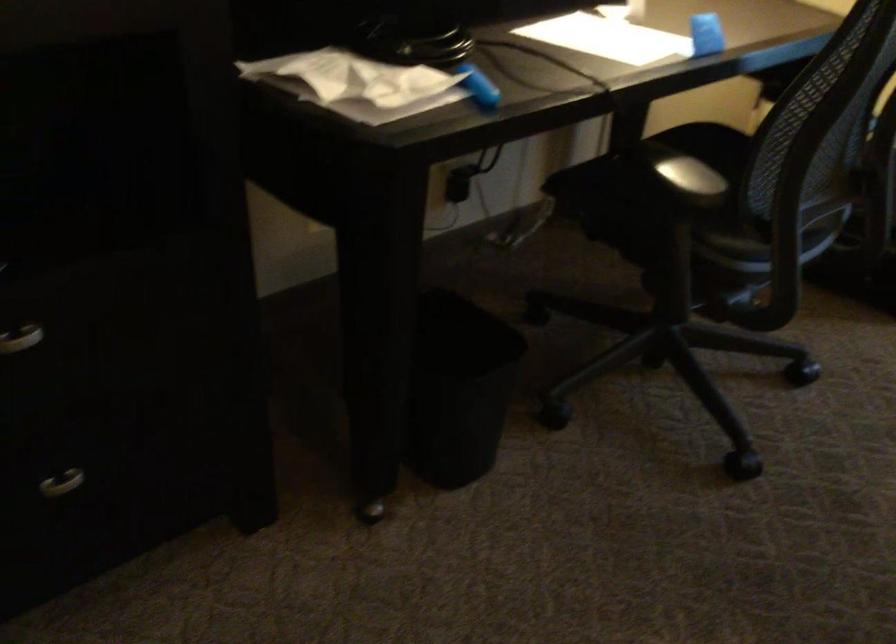
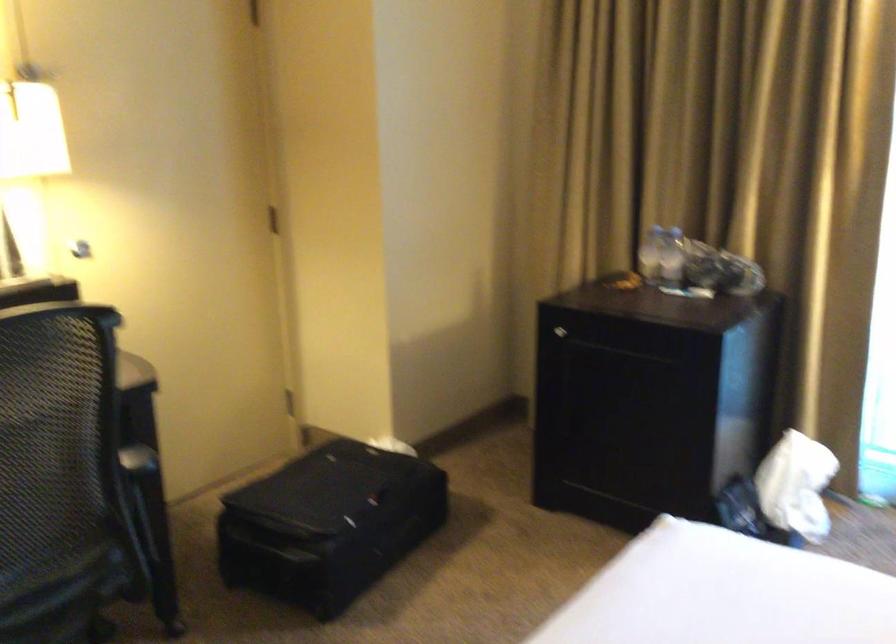
Find the pixel in the second image that matches [810,185] in the first image.

(136, 527)